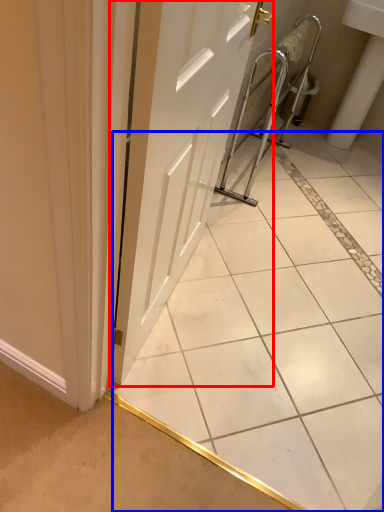
Question: Which object is further to the camera taking this photo, door (highlighted by a red box) or ceramic tile (highlighted by a blue box)?

Choices:
 (A) door
 (B) ceramic tile

Answer: (A)